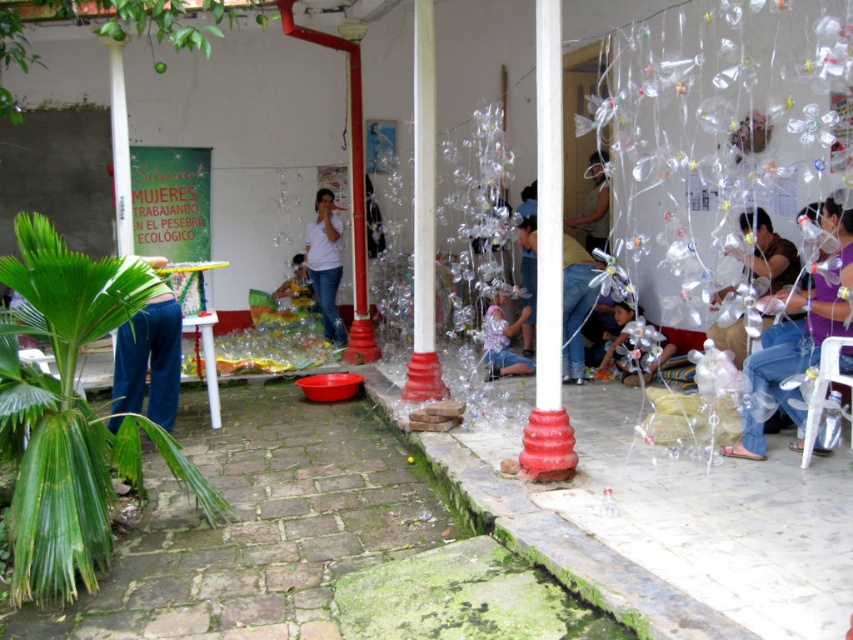
The width and height of the screenshot is (853, 640). In order to click on metallic silver bracelet at lower right in this screenshot , I will do `click(798, 333)`.

Does metallic silver bracelet at lower right have a larger size compared to blue jeans at left?

Actually, metallic silver bracelet at lower right might be smaller than blue jeans at left.

Is point (843, 324) positioned before point (120, 340)?

Yes, it is.

Image resolution: width=853 pixels, height=640 pixels. Find the location of `metallic silver bracelet at lower right`. metallic silver bracelet at lower right is located at coordinates (798, 333).

Is metallic silver pinwheel at center smaller than matte white shirt at center?

Yes, metallic silver pinwheel at center is smaller than matte white shirt at center.

Is metallic silver pinwheel at center above matte white shirt at center?

No, metallic silver pinwheel at center is not above matte white shirt at center.

Is point (512, 364) farther from viewer compared to point (595, 243)?

No, it is not.

At what (x,y) coordinates should I click in order to perform the action: click on metallic silver pinwheel at center. Please return your answer as a coordinate pair (x, y). Looking at the image, I should click on (502, 340).

Does blue jeans at left appear on the left side of white matte shirt at center?

Correct, you'll find blue jeans at left to the left of white matte shirt at center.

Between point (117, 330) and point (335, 337), which one is positioned behind?

Positioned behind is point (335, 337).

Is point (114, 422) farther from camera compared to point (335, 248)?

No, (114, 422) is in front of (335, 248).

Locate an element on the screen. The image size is (853, 640). blue jeans at left is located at coordinates (149, 358).